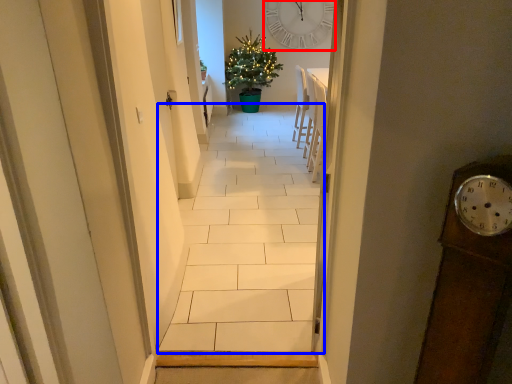
Question: Which object is further to the camera taking this photo, clock (highlighted by a red box) or path (highlighted by a blue box)?

Choices:
 (A) clock
 (B) path

Answer: (A)